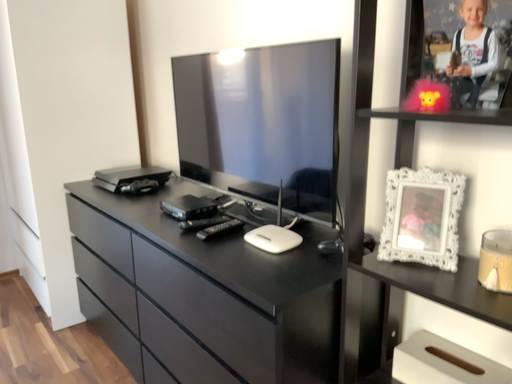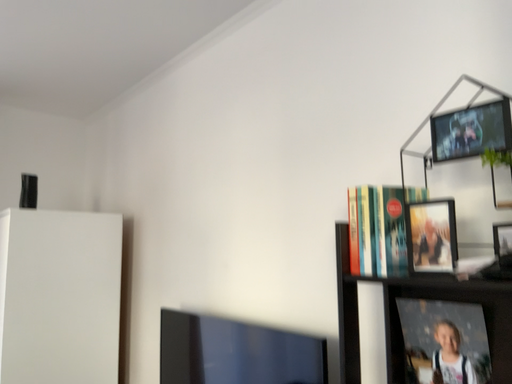
Question: Which way did the camera rotate in the video?

Choices:
 (A) rotated upward
 (B) rotated downward

Answer: (A)